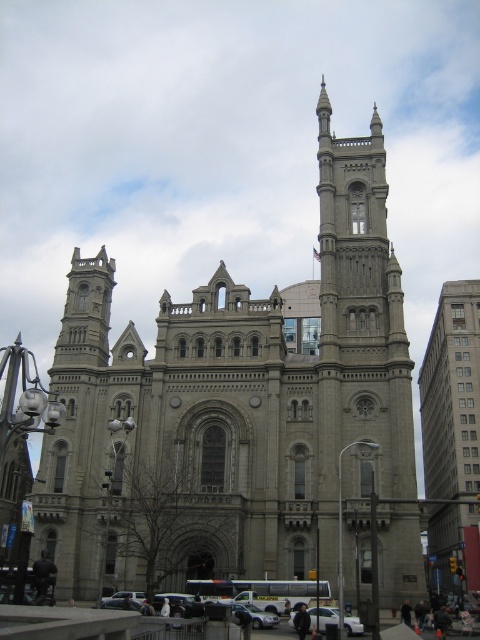
You are standing in front of the gray stone church at center and want to walk towards the gray stone tower at upper center. In which direction should you move?

You should move to the right because the gray stone church at center is to the left of the gray stone tower at upper center, so moving right will take you towards it.